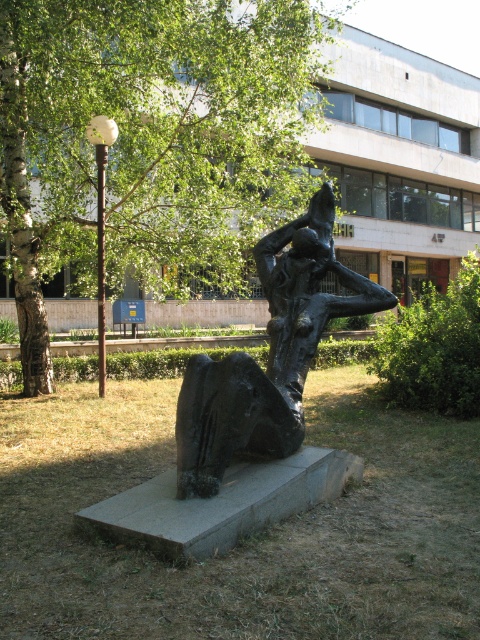
Is point (256, 4) positioned in front of point (219, 449)?

No, it is behind (219, 449).

Is green leafy tree at upper left smaller than bronze sculpture at center?

Correct, green leafy tree at upper left occupies less space than bronze sculpture at center.

Does point (196, 220) lie behind point (235, 410)?

Yes, it is behind point (235, 410).

Where is `green leafy tree at upper left`? green leafy tree at upper left is located at coordinates (148, 141).